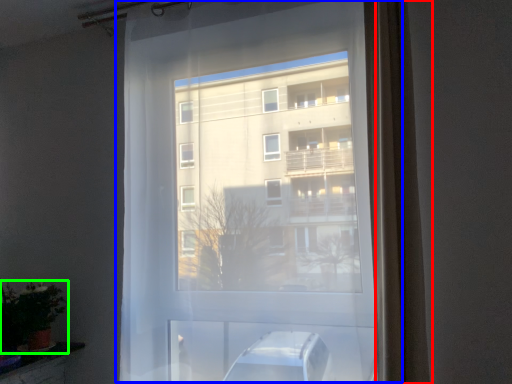
Question: Which object is the farthest from curtain (highlighted by a red box)? Choose among these: window (highlighted by a blue box) or houseplant (highlighted by a green box).

Choices:
 (A) window
 (B) houseplant

Answer: (B)